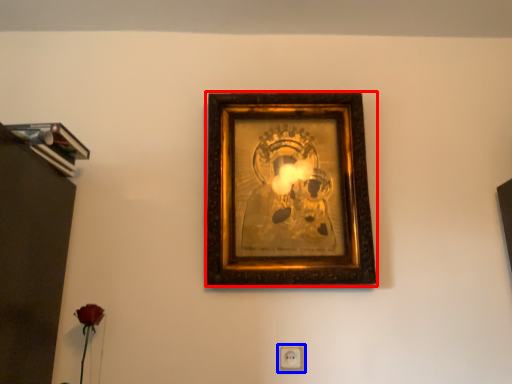
Question: Which object appears closest to the camera in this image, picture frame (highlighted by a red box) or electric outlet (highlighted by a blue box)?

Choices:
 (A) picture frame
 (B) electric outlet

Answer: (A)